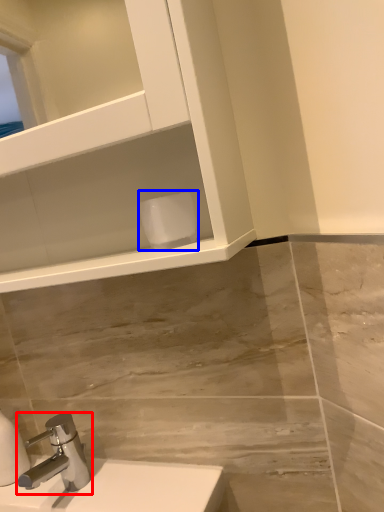
Question: Which object is closer to the camera taking this photo, tap (highlighted by a red box) or toilet paper (highlighted by a blue box)?

Choices:
 (A) tap
 (B) toilet paper

Answer: (B)